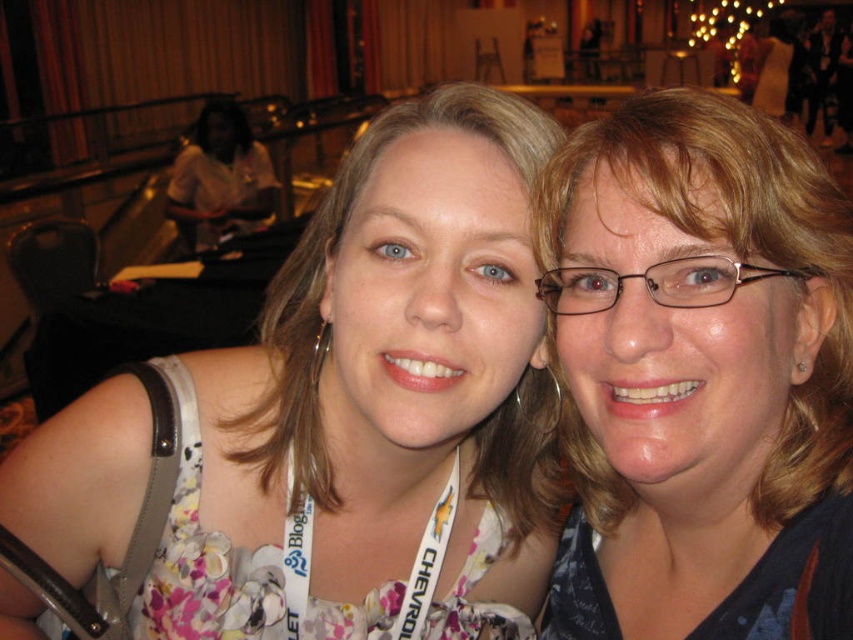
You are standing at the point labeled point (129, 584) and want to move to the point labeled point (753, 314). Given that the distance between them is 0.5 meters, can you walk directly towards your destination without any obstacles?

The distance between point (129, 584) and point (753, 314) is 0.5 meters. Since there are no obstacles mentioned in the scene description, you can walk directly towards your destination without any issues.

You are a photographer trying to focus on the floral fabric dress at center and the white fabric lanyard at center. Which one is closer to the camera lens?

The floral fabric dress at center is located above the white fabric lanyard at center, so it is closer to the camera lens.

You are a photographer adjusting the camera focus. You notice the floral fabric dress at center and the white fabric lanyard at center in your frame. Which object should you focus on first if you want to ensure the taller object is in sharp focus?

The floral fabric dress at center is taller than the white fabric lanyard at center, so you should focus on the floral fabric dress at center first to ensure it is in sharp focus.